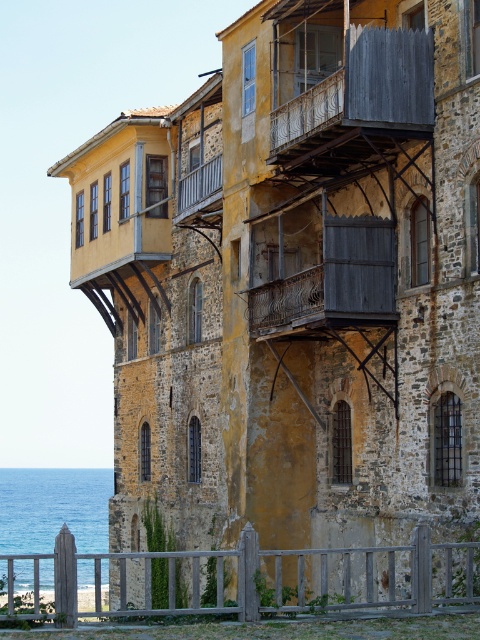
Can you confirm if wooden/weathered balcony at center is positioned to the left of wooden at upper center?

No, wooden/weathered balcony at center is not to the left of wooden at upper center.

Measure the distance between point (297, 291) and camera.

The distance of point (297, 291) from camera is 51.05 meters.

Between point (372, 282) and point (194, 189), which one is positioned behind?

Positioned behind is point (194, 189).

You are a GUI agent. You are given a task and a screenshot of the screen. Output one action in this format:
    pyautogui.click(x=<x>, y=<y>)
    Task: Click on the wooden/weathered balcony at center
    
    Given the screenshot: What is the action you would take?
    pyautogui.click(x=327, y=280)

How distant is wooden fence at lower center from wooden slats at upper right?

A distance of 56.39 feet exists between wooden fence at lower center and wooden slats at upper right.

Looking at this image, can you confirm if wooden fence at lower center is positioned to the left of wooden slats at upper right?

Correct, you'll find wooden fence at lower center to the left of wooden slats at upper right.

In order to click on wooden fence at lower center in this screenshot , I will do `click(244, 580)`.

The image size is (480, 640). What are the coordinates of `wooden fence at lower center` in the screenshot? It's located at (244, 580).

Is wooden slats at upper right shorter than wooden at upper center?

In fact, wooden slats at upper right may be taller than wooden at upper center.

Measure the distance between point (349, 140) and camera.

46.75 meters

Identify the location of wooden slats at upper right. The image size is (480, 640). (357, 100).